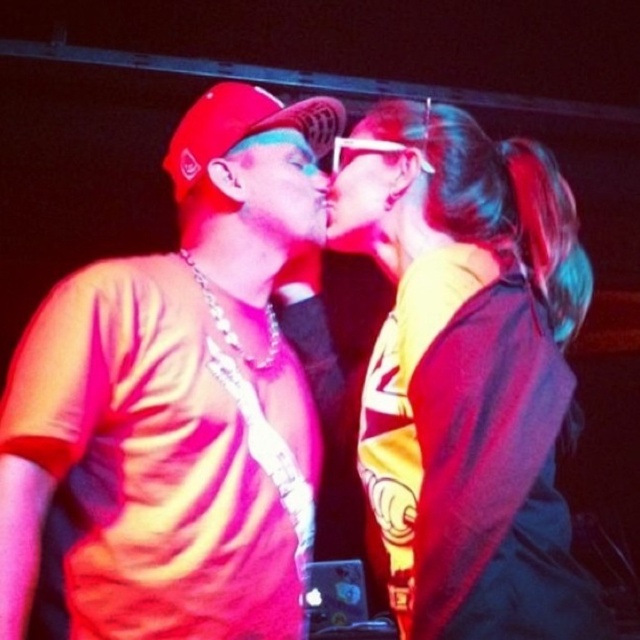
You are an artist trying to sketch the scene. You need to place the matte red cap at center accurately. According to the coordinates provided, where should you position it on your canvas?

The matte red cap at center should be positioned at coordinates point 0.647 on the x axis and 0.267 on the y axis.

You are a photographer setting up a shoot with two main elements in the frame. You have a matte red cap at center and a yellow fabric at center. Your client wants to know which object will occupy more space in the photo. Based on the scene description, which object should you inform them is larger?

The matte red cap at center is bigger than the yellow fabric at center, so the matte red cap at center will occupy more space in the photo.